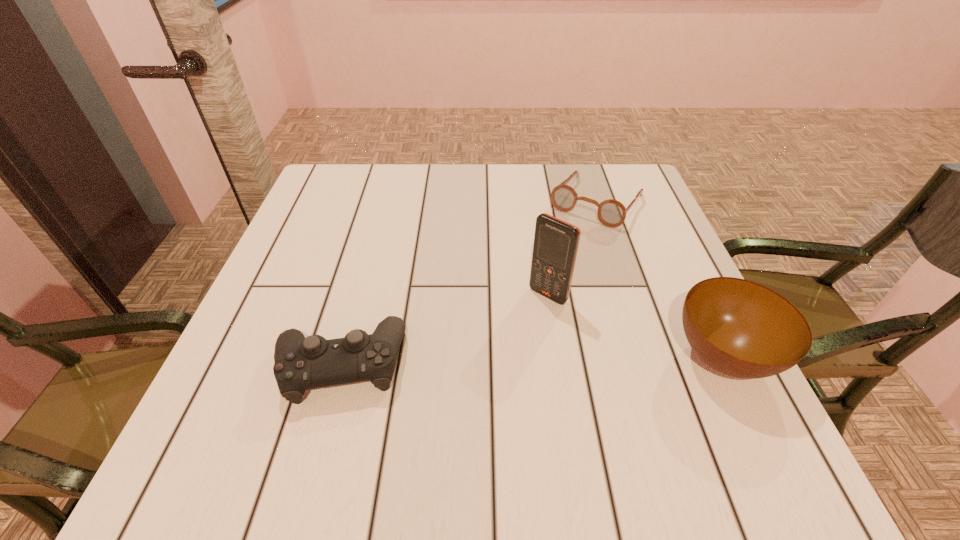
At what (x,y) coordinates should I click in order to perform the action: click on object that is the nearest to the cellular telephone. Please return your answer as a coordinate pair (x, y). Looking at the image, I should click on (740, 328).

Where is `object that is the third closest to the bowl`? object that is the third closest to the bowl is located at coordinates (301, 363).

Locate an element on the screen. vacant space that satisfies the following two spatial constraints: 1. on the back side of the tallest object; 2. on the right side of the second shortest object is located at coordinates (358, 295).

This screenshot has height=540, width=960. I want to click on free spot that satisfies the following two spatial constraints: 1. on the back side of the control; 2. on the right side of the spectacles, so click(x=384, y=201).